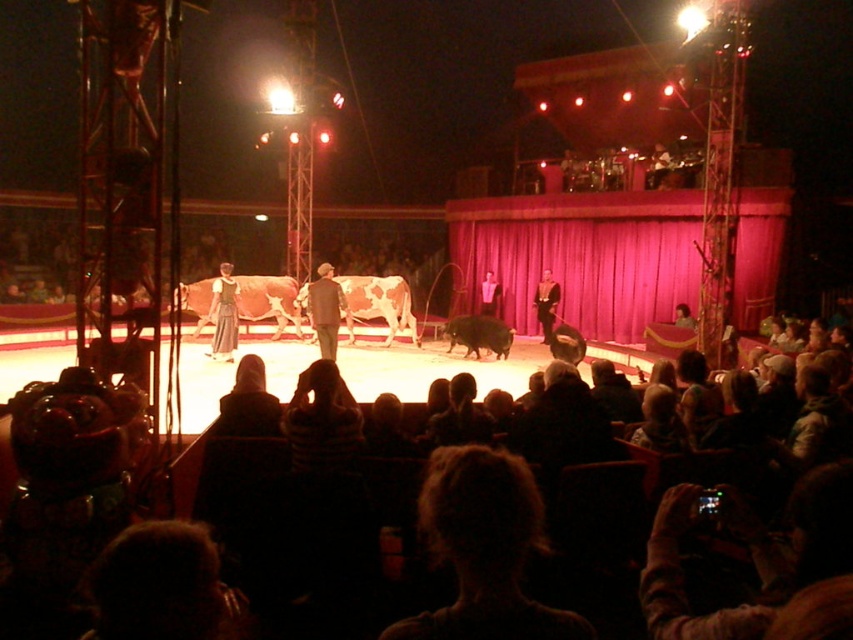
Question: Does dark hair at lower center have a lesser width compared to formal black suit at center?

Choices:
 (A) yes
 (B) no

Answer: (B)

Question: Does dark hair at lower center appear on the left side of dark gray suit at center?

Choices:
 (A) no
 (B) yes

Answer: (A)

Question: Which of the following is the farthest from the observer?

Choices:
 (A) smooth black suit at center
 (B) formal black suit at center
 (C) dark brown hair at center
 (D) dark hair at lower center

Answer: (A)

Question: Which object is the farthest from the dark brown hair at center?

Choices:
 (A) smooth black suit at center
 (B) formal black suit at center

Answer: (A)

Question: Considering the real-world distances, which object is farthest from the dark brown hair at center?

Choices:
 (A) formal black suit at center
 (B) dark hair at lower center
 (C) smooth black suit at center
 (D) dark gray suit at center

Answer: (C)

Question: Considering the relative positions of dark gray suit at center and smooth black suit at center in the image provided, where is dark gray suit at center located with respect to smooth black suit at center?

Choices:
 (A) left
 (B) right

Answer: (A)